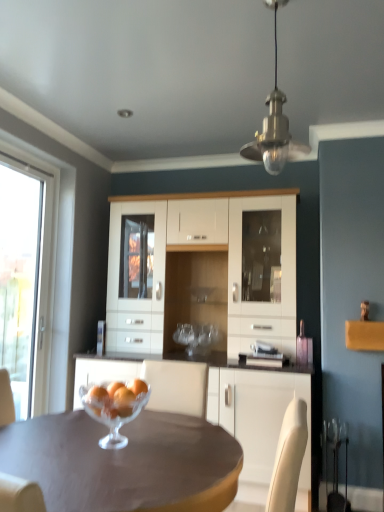
Describe the element at coordinates (115, 407) in the screenshot. I see `clear glass bowl at center` at that location.

Describe the element at coordinates (125, 463) in the screenshot. I see `matte brown table at center` at that location.

The image size is (384, 512). In order to click on white glossy cabinet at center in this screenshot , I will do `click(209, 320)`.

In order to face white glossy cabinet at center, should I rotate leftwards or rightwards?

Turn right approximately 5.157 degrees to face it.

What do you see at coordinates (218, 404) in the screenshot?
I see `white glossy cabinet at center` at bounding box center [218, 404].

The height and width of the screenshot is (512, 384). What do you see at coordinates (273, 124) in the screenshot? I see `metallic brass pendant light at upper center` at bounding box center [273, 124].

This screenshot has width=384, height=512. Describe the element at coordinates (123, 401) in the screenshot. I see `orange matte glass bowl at center` at that location.

The height and width of the screenshot is (512, 384). I want to click on clear glass bowl at center, so click(115, 407).

Is transparent glass window at left a part of white glossy cabinet at center?

No, transparent glass window at left is located outside of white glossy cabinet at center.

Considering the relative positions of white glossy cabinet at center and transparent glass window at left in the image provided, is white glossy cabinet at center behind transparent glass window at left?

Yes, white glossy cabinet at center is further from the viewer.

From the image's perspective, is white glossy cabinet at center over transparent glass window at left?

No, from the image's perspective, white glossy cabinet at center is not on top of transparent glass window at left.

Is white glossy cabinet at center positioned with its back to transparent glass window at left?

No, transparent glass window at left is not at the back of white glossy cabinet at center.

Which of these two, orange matte glass bowl at center or matte brown table at center, is bigger?

matte brown table at center is bigger.

Is orange matte glass bowl at center situated inside matte brown table at center or outside?

orange matte glass bowl at center is located beyond the bounds of matte brown table at center.

Consider the image. From the image's perspective, which is above, orange matte glass bowl at center or matte brown table at center?

orange matte glass bowl at center, from the image's perspective.

Is orange matte glass bowl at center positioned behind matte brown table at center?

Yes.

Does metallic brass pendant light at upper center have a lesser width compared to clear glass bowl at center?

Yes.

In the image, is metallic brass pendant light at upper center positioned in front of or behind clear glass bowl at center?

metallic brass pendant light at upper center is in front of clear glass bowl at center.

Would you say metallic brass pendant light at upper center is inside or outside clear glass bowl at center?

metallic brass pendant light at upper center lies outside clear glass bowl at center.

Where is `lamp lying on the right of matte brown table at center`? lamp lying on the right of matte brown table at center is located at coordinates (273, 124).

From the image's perspective, is metallic brass pendant light at upper center under matte brown table at center?

Actually, metallic brass pendant light at upper center appears above matte brown table at center in the image.

Are metallic brass pendant light at upper center and matte brown table at center far apart?

metallic brass pendant light at upper center is far away from matte brown table at center.

Considering the points (271, 157) and (14, 425), which point is in front, point (271, 157) or point (14, 425)?

The point (271, 157) is closer to the camera.

Based on the photo, does matte brown table at center turn towards white glossy cabinet at center?

No, matte brown table at center is not aimed at white glossy cabinet at center.

Is matte brown table at center not inside white glossy cabinet at center?

matte brown table at center lies outside white glossy cabinet at center's area.

Considering the positions of objects matte brown table at center and white glossy cabinet at center in the image provided, who is more to the left, matte brown table at center or white glossy cabinet at center?

Positioned to the left is matte brown table at center.

Is transparent glass window at left to the left of white glossy cabinet at center from the viewer's perspective?

Yes.

Could you tell me if transparent glass window at left is turned towards white glossy cabinet at center?

No.

Can you confirm if transparent glass window at left is taller than white glossy cabinet at center?

In fact, transparent glass window at left may be shorter than white glossy cabinet at center.

Between white glossy cabinet at center and clear glass bowl at center, which one appears on the left side from the viewer's perspective?

Positioned to the left is clear glass bowl at center.

Is white glossy cabinet at center closer to the viewer compared to clear glass bowl at center?

Yes, white glossy cabinet at center is in front of clear glass bowl at center.

Is white glossy cabinet at center aimed at clear glass bowl at center?

Yes.

Where is `tableware lying behind the white glossy cabinet at center`? tableware lying behind the white glossy cabinet at center is located at coordinates (115, 407).

Image resolution: width=384 pixels, height=512 pixels. Identify the location of window in front of the white glossy cabinet at center. (34, 271).

The height and width of the screenshot is (512, 384). What are the coordinates of `desk directly beneath the orange matte glass bowl at center (from a real-world perspective)` in the screenshot? It's located at (125, 463).

Based on their spatial positions, is white glossy cabinet at center or orange matte glass bowl at center further from white glossy cabinet at center?

Based on the image, orange matte glass bowl at center appears to be further to white glossy cabinet at center.

Estimate the real-world distances between objects in this image. Which object is closer to matte brown table at center, metallic brass pendant light at upper center or orange matte glass bowl at center?

orange matte glass bowl at center.

Looking at the image, which one is located further to white glossy cabinet at center, metallic brass pendant light at upper center or transparent glass window at left?

metallic brass pendant light at upper center is further to white glossy cabinet at center.

Estimate the real-world distances between objects in this image. Which object is closer to matte brown table at center, orange matte glass bowl at center or metallic brass pendant light at upper center?

orange matte glass bowl at center.

Based on their spatial positions, is metallic brass pendant light at upper center or clear glass bowl at center closer to orange matte glass bowl at center?

Based on the image, clear glass bowl at center appears to be nearer to orange matte glass bowl at center.

Based on their spatial positions, is clear glass bowl at center or transparent glass window at left further from metallic brass pendant light at upper center?

Based on the image, transparent glass window at left appears to be further to metallic brass pendant light at upper center.

Based on their spatial positions, is white glossy cabinet at center or clear glass bowl at center closer to transparent glass window at left?

white glossy cabinet at center.

Looking at the image, which one is located closer to transparent glass window at left, white glossy cabinet at center or clear glass bowl at center?

Based on the image, white glossy cabinet at center appears to be nearer to transparent glass window at left.

Locate an element on the screen. The height and width of the screenshot is (512, 384). orange positioned between matte brown table at center and transparent glass window at left from near to far is located at coordinates (123, 401).

Where is `tableware between matte brown table at center and orange matte glass bowl at center along the z-axis`? The height and width of the screenshot is (512, 384). tableware between matte brown table at center and orange matte glass bowl at center along the z-axis is located at coordinates (115, 407).

I want to click on orange between clear glass bowl at center and transparent glass window at left along the z-axis, so click(x=123, y=401).

At what (x,y) coordinates should I click in order to perform the action: click on orange between clear glass bowl at center and white glossy cabinet at center from front to back. Please return your answer as a coordinate pair (x, y). The width and height of the screenshot is (384, 512). Looking at the image, I should click on (123, 401).